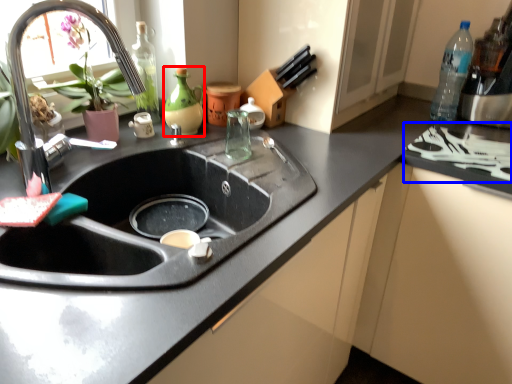
Question: Which object is closer to the camera taking this photo, bottle (highlighted by a red box) or stove (highlighted by a blue box)?

Choices:
 (A) bottle
 (B) stove

Answer: (B)